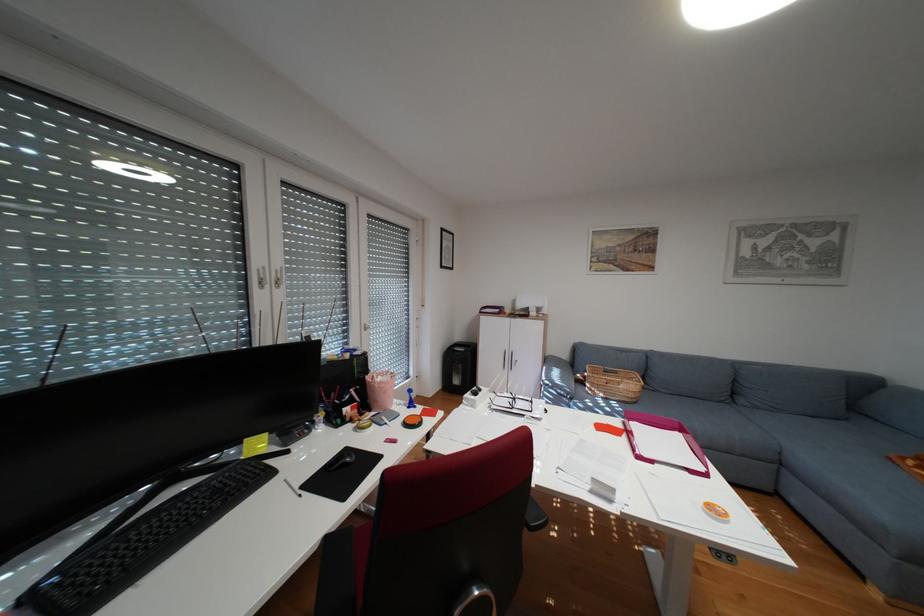
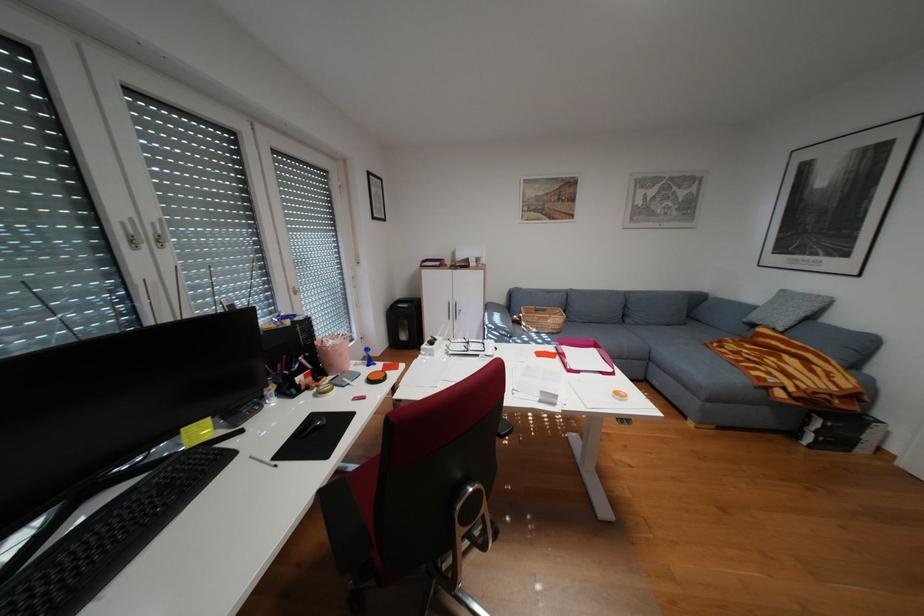
In the second image, find the point that corresponds to (520,310) in the first image.

(460, 262)